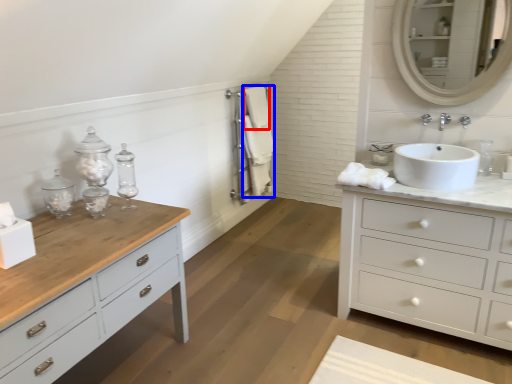
Question: Which object appears closest to the camera in this image, bath towel (highlighted by a red box) or bath towel (highlighted by a blue box)?

Choices:
 (A) bath towel
 (B) bath towel

Answer: (B)